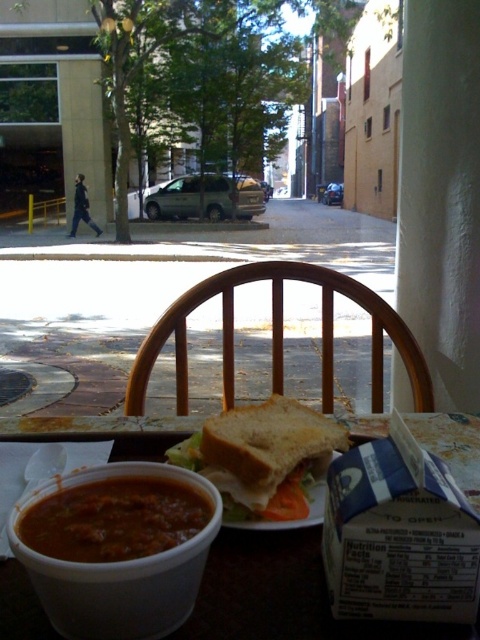
Who is lower down, wooden chair at center or white bread sandwich at center?

Positioned lower is wooden chair at center.

Is point (230, 268) less distant than point (241, 456)?

No, (230, 268) is behind (241, 456).

What do you see at coordinates (278, 336) in the screenshot?
I see `wooden chair at center` at bounding box center [278, 336].

Where is `wooden chair at center`? wooden chair at center is located at coordinates (278, 336).

Is wooden chair at center to the left of thick tomato soup at lower left from the viewer's perspective?

No, wooden chair at center is not to the left of thick tomato soup at lower left.

Between wooden chair at center and thick tomato soup at lower left, which one has less height?

thick tomato soup at lower left is shorter.

Find the location of a particular element. This screenshot has height=640, width=480. wooden chair at center is located at coordinates (278, 336).

Is white bread sandwich at center taller than thick tomato soup at lower left?

Correct, white bread sandwich at center is much taller as thick tomato soup at lower left.

Identify the location of white bread sandwich at center. The width and height of the screenshot is (480, 640). (264, 456).

The width and height of the screenshot is (480, 640). In order to click on white bread sandwich at center in this screenshot , I will do `click(264, 456)`.